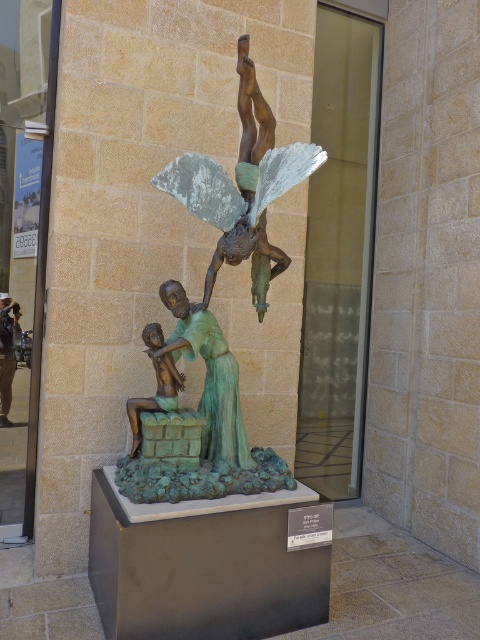
This screenshot has width=480, height=640. In order to click on green patina statue at center in this screenshot , I will do `click(208, 376)`.

Which is behind, point (228, 371) or point (159, 356)?

Positioned behind is point (228, 371).

Is point (180, 300) in front of point (176, 388)?

Yes, it is in front of point (176, 388).

This screenshot has height=640, width=480. Find the location of `green patina statue at center`. green patina statue at center is located at coordinates point(208,376).

Does green patina statue at center have a greater width compared to bronze statue at center?

Yes, green patina statue at center is wider than bronze statue at center.

Consider the image. Measure the distance between point (212, 344) and camera.

They are 8.93 feet apart.

Locate an element on the screen. green patina statue at center is located at coordinates (208, 376).

In the scene shown: Is green patina bronze sculpture at center shorter than bronze figure at center?

No, green patina bronze sculpture at center is not shorter than bronze figure at center.

Is green patina bronze sculpture at center smaller than bronze figure at center?

No, green patina bronze sculpture at center is not smaller than bronze figure at center.

Identify the location of green patina bronze sculpture at center. (213, 314).